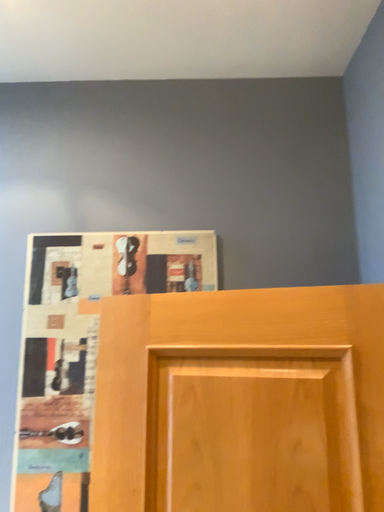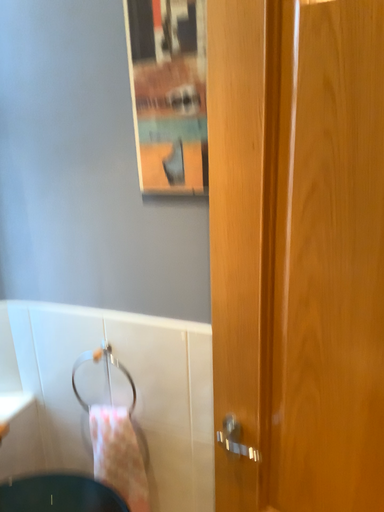
Question: Which way did the camera rotate in the video?

Choices:
 (A) rotated upward
 (B) rotated downward

Answer: (B)